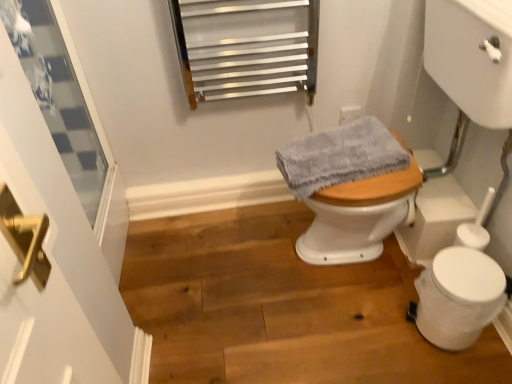
Question: Can we say clear glass window at upper left lies outside white plastic toilet bowl at lower right?

Choices:
 (A) yes
 (B) no

Answer: (A)

Question: Are clear glass window at upper left and white plastic toilet bowl at lower right located far from each other?

Choices:
 (A) yes
 (B) no

Answer: (A)

Question: Considering the relative positions of clear glass window at upper left and white plastic toilet bowl at lower right in the image provided, is clear glass window at upper left to the right of white plastic toilet bowl at lower right from the viewer's perspective?

Choices:
 (A) yes
 (B) no

Answer: (B)

Question: Is clear glass window at upper left turned away from white plastic toilet bowl at lower right?

Choices:
 (A) yes
 (B) no

Answer: (B)

Question: Is clear glass window at upper left oriented towards white plastic toilet bowl at lower right?

Choices:
 (A) yes
 (B) no

Answer: (A)

Question: Considering the positions of gray fabric at center and wooden floor at center in the image, is gray fabric at center taller or shorter than wooden floor at center?

Choices:
 (A) short
 (B) tall

Answer: (B)

Question: From a real-world perspective, is gray fabric at center above or below wooden floor at center?

Choices:
 (A) above
 (B) below

Answer: (A)

Question: Is point (369, 198) positioned closer to the camera than point (234, 213)?

Choices:
 (A) farther
 (B) closer

Answer: (B)

Question: Is gray fabric at center bigger or smaller than wooden floor at center?

Choices:
 (A) big
 (B) small

Answer: (B)

Question: From their relative heights in the image, would you say gray fabric at center is taller or shorter than white plastic toilet bowl at lower right?

Choices:
 (A) tall
 (B) short

Answer: (B)

Question: From a real-world perspective, is gray fabric at center positioned above or below white plastic toilet bowl at lower right?

Choices:
 (A) above
 (B) below

Answer: (A)

Question: From the image's perspective, is gray fabric at center above or below white plastic toilet bowl at lower right?

Choices:
 (A) below
 (B) above

Answer: (B)

Question: Looking at the image, does gray fabric at center seem bigger or smaller compared to white plastic toilet bowl at lower right?

Choices:
 (A) big
 (B) small

Answer: (A)

Question: From the image's perspective, is clear glass window at upper left positioned above or below white plastic toilet bowl at lower right?

Choices:
 (A) below
 (B) above

Answer: (B)

Question: Considering their positions, is clear glass window at upper left located in front of or behind white plastic toilet bowl at lower right?

Choices:
 (A) front
 (B) behind

Answer: (A)